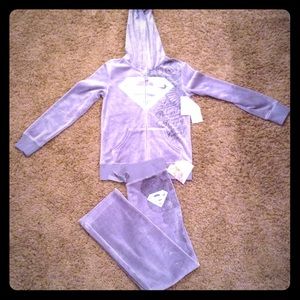
The height and width of the screenshot is (300, 300). In order to click on hood in this screenshot , I will do tap(144, 32).